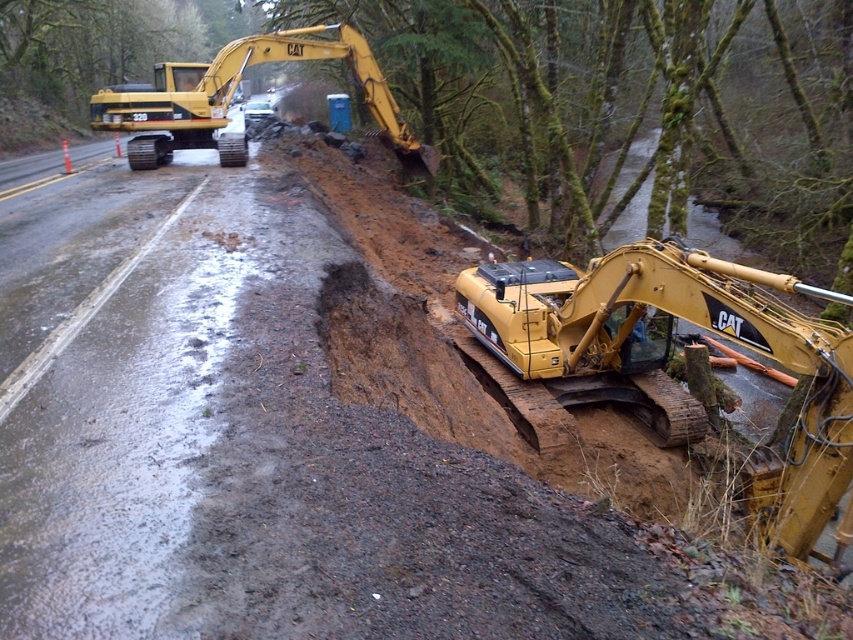
Looking at this image, you are a construction worker standing at the edge of the road in the wooded area. You need to locate the yellow metallic excavator at center. According to the coordinates provided, where exactly is it positioned?

The yellow metallic excavator at center is positioned at coordinates point (666, 352).

You are a construction worker standing at the edge of the road and want to move from the yellow metallic excavator at upper left to the yellow metallic excavator at center. Which direction should you walk to reach it?

The yellow metallic excavator at center is to the right of the yellow metallic excavator at upper left, so you should walk to the right to reach it.

You are a construction worker who needs to choose the larger excavator for a heavy lifting task. Which one between the yellow metallic excavator at center and the yellow metallic excavator at upper left should you select?

The yellow metallic excavator at upper left is larger in size compared to the yellow metallic excavator at center, so you should select the yellow metallic excavator at upper left for the heavy lifting task.